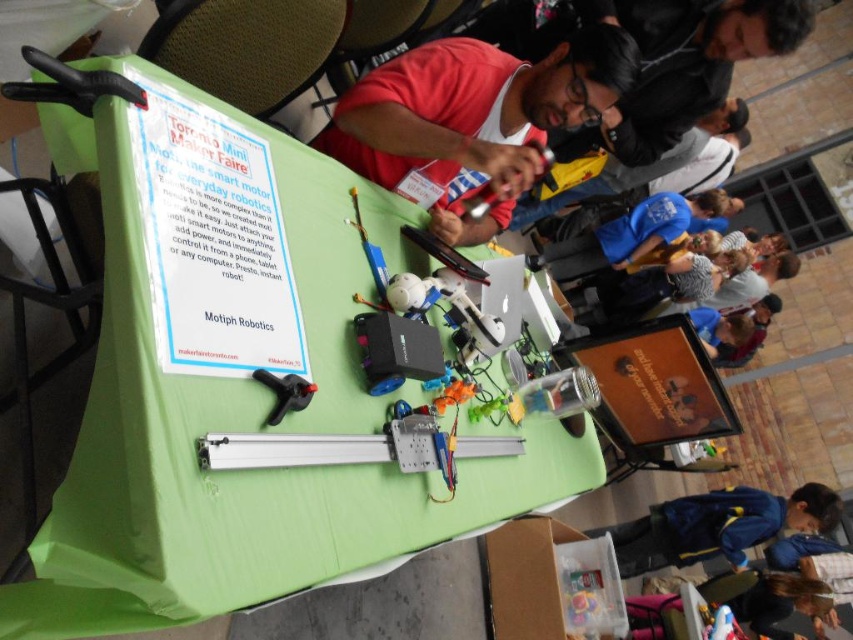
Question: Which point is farther from the camera taking this photo?

Choices:
 (A) (296, 220)
 (B) (306, 388)
 (C) (453, 266)
 (D) (625, 540)

Answer: (D)

Question: Can you confirm if red matte shirt at center is smaller than black plastic tool at center?

Choices:
 (A) yes
 (B) no

Answer: (B)

Question: Does red matte shirt at center come behind black plastic tool at center?

Choices:
 (A) yes
 (B) no

Answer: (A)

Question: Which object is positioned closest to the red matte shirt at center?

Choices:
 (A) green fabric table at center
 (B) blue fabric jacket at lower right

Answer: (A)

Question: Estimate the real-world distances between objects in this image. Which object is closer to the red matte shirt at center?

Choices:
 (A) matte black laptop at center
 (B) orange matte signboard at center

Answer: (A)

Question: Can you confirm if orange matte signboard at center is smaller than matte black laptop at center?

Choices:
 (A) yes
 (B) no

Answer: (B)